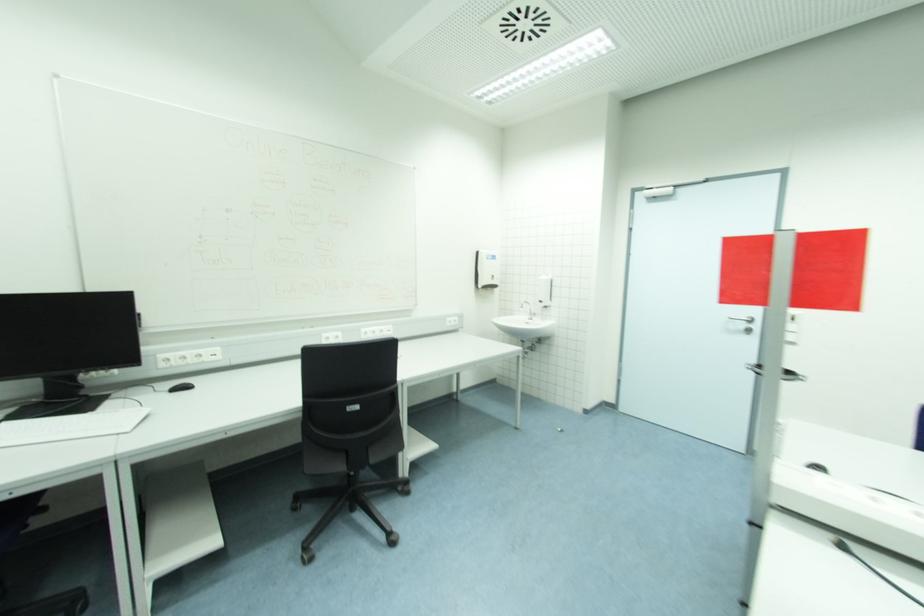
Where is `silver door handle`? The height and width of the screenshot is (616, 924). silver door handle is located at coordinates (738, 318).